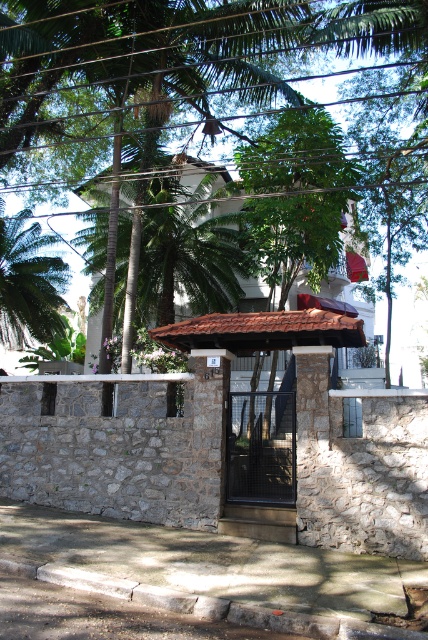
You are standing in front of the stone wall and gate. There are two green leafy palm trees in the scene. Which one, the green leafy palm tree at center or the green leafy palm tree at left, is positioned higher up in the image?

The green leafy palm tree at center is located above the green leafy palm tree at left, so it is positioned higher up in the image.

You are standing in front of the stone wall and gate. You notice two green leafy palm trees in the scene. Which one, the green leafy palm tree at center or the green leafy palm tree at left, is taller?

The green leafy palm tree at center is taller than the green leafy palm tree at left.